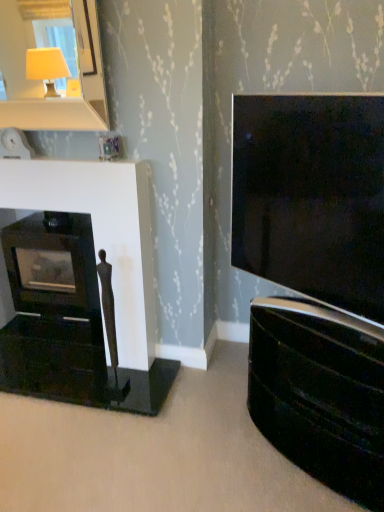
Locate an element on the screen. vacant point above glossy black tv cabinet at right (from a real-world perspective) is located at coordinates (305, 322).